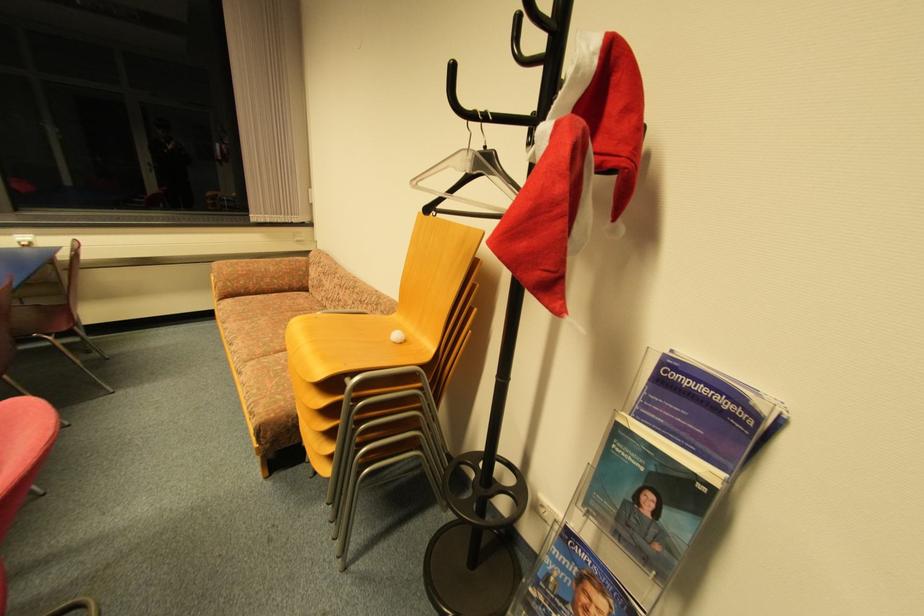
I want to click on wooden chair sitting surface, so click(x=347, y=344).